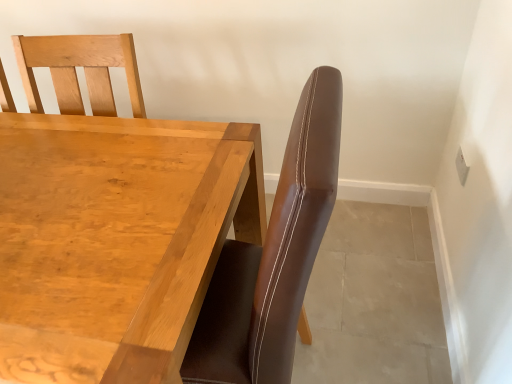
This screenshot has width=512, height=384. Describe the element at coordinates (116, 238) in the screenshot. I see `light brown wood table at center` at that location.

Identify the location of light brown wood table at center. (116, 238).

Locate an element on the screen. This screenshot has width=512, height=384. light brown wood table at center is located at coordinates (116, 238).